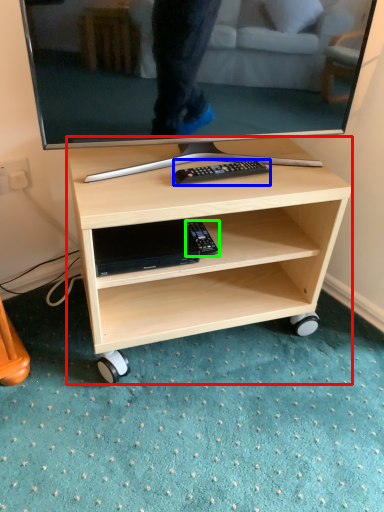
Question: Based on their relative distances, which object is nearer to desk (highlighted by a red box)? Choose from remote (highlighted by a blue box) and equipment (highlighted by a green box).

Choices:
 (A) remote
 (B) equipment

Answer: (B)